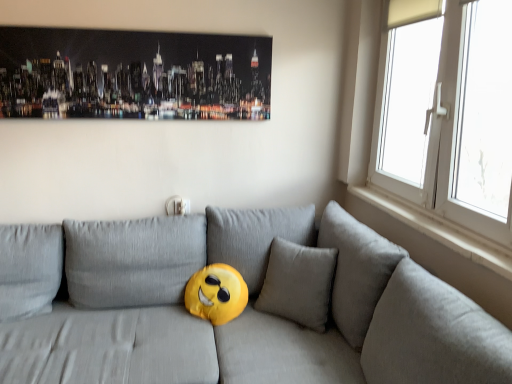
Where is `free space above metallic cityscape art at upper center (from a real-world perspective)`? Image resolution: width=512 pixels, height=384 pixels. free space above metallic cityscape art at upper center (from a real-world perspective) is located at coordinates (147, 30).